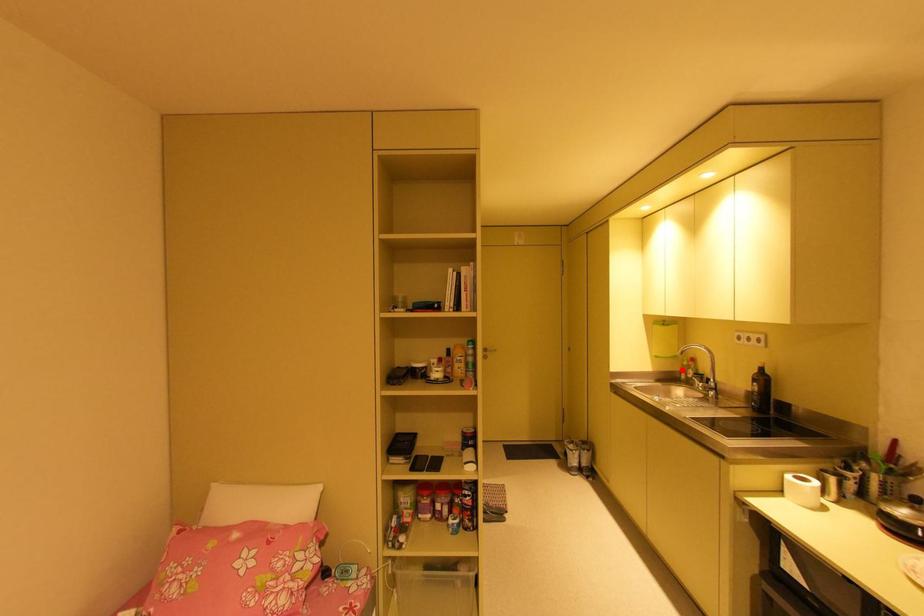
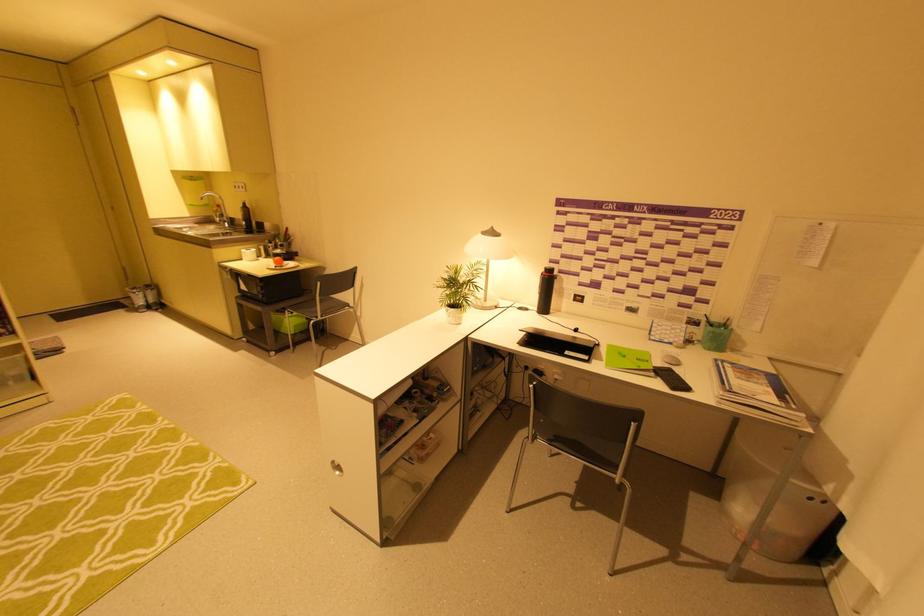
Question: I am providing you with two images of the same scene from different viewpoints. A red point is marked on the first image. Is the red point's position out of view in image 2?

Choices:
 (A) Yes
 (B) No

Answer: (B)